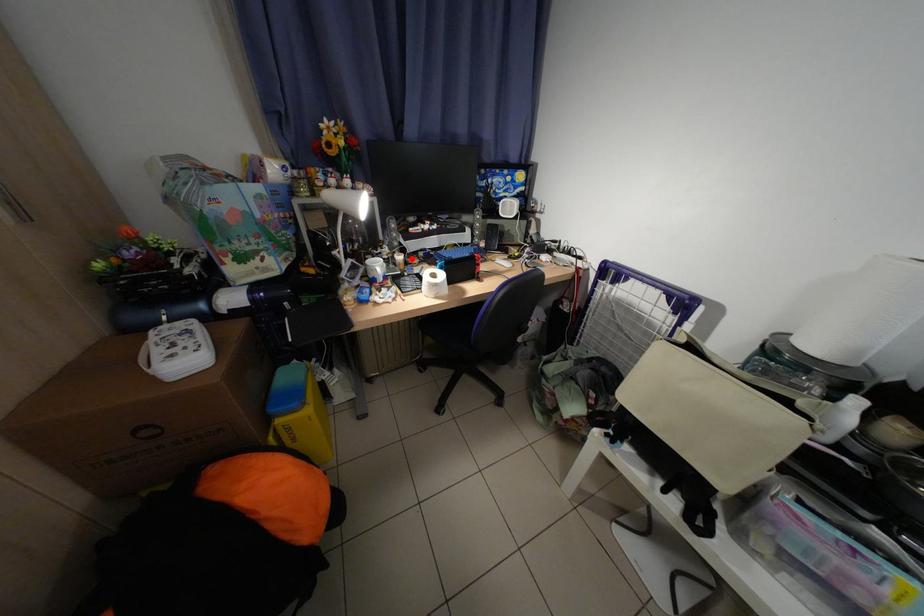
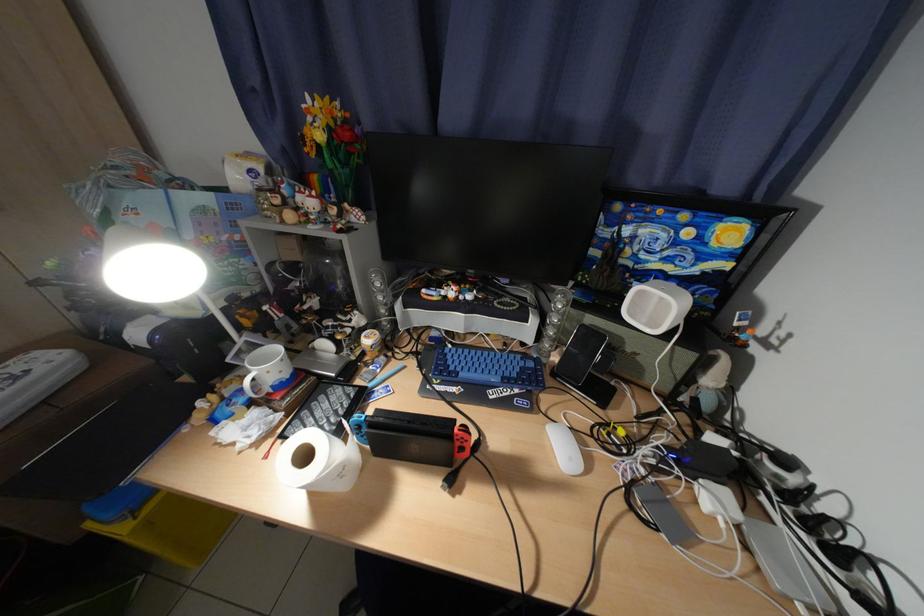
Find the pixel in the second image that matches the highlighted location in the first image.

(381, 341)